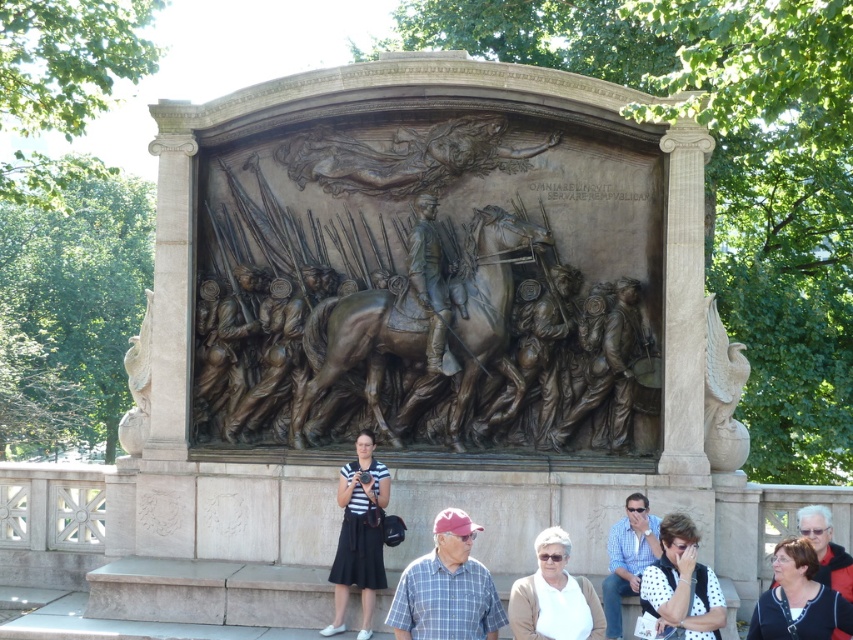
Is striped cotton shirt at center behind white fabric at lower center?

Yes, striped cotton shirt at center is behind white fabric at lower center.

Does striped cotton shirt at center appear on the left side of white fabric at lower center?

Correct, you'll find striped cotton shirt at center to the left of white fabric at lower center.

Locate an element on the screen. This screenshot has width=853, height=640. striped cotton shirt at center is located at coordinates (358, 532).

Identify the location of striped cotton shirt at center. (358, 532).

Does white dotted shirt at lower right have a greater height compared to blue plaid shirt at lower right?

Yes.

Does white dotted shirt at lower right appear on the left side of blue plaid shirt at lower right?

Incorrect, white dotted shirt at lower right is not on the left side of blue plaid shirt at lower right.

Does point (717, 593) come in front of point (630, 525)?

Yes, it is in front of point (630, 525).

The width and height of the screenshot is (853, 640). Identify the location of white dotted shirt at lower right. (682, 582).

Consider the image. Which is more to the left, plaid shirt at center or blue plaid shirt at lower right?

plaid shirt at center is more to the left.

Is plaid shirt at center further to the viewer compared to blue plaid shirt at lower right?

No, it is in front of blue plaid shirt at lower right.

Between point (410, 584) and point (618, 532), which one is positioned behind?

The point (618, 532) is more distant.

Where is `plaid shirt at center`? plaid shirt at center is located at coordinates (445, 588).